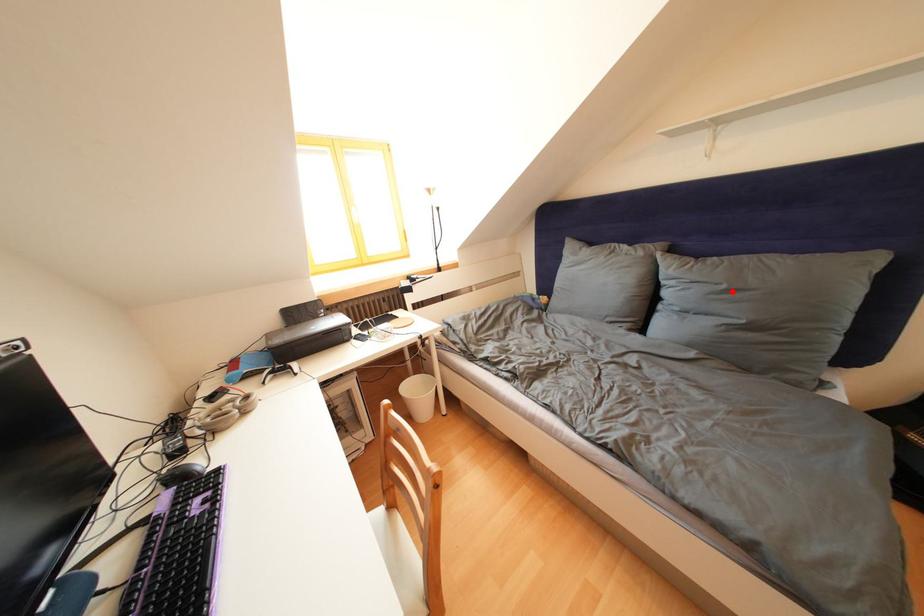
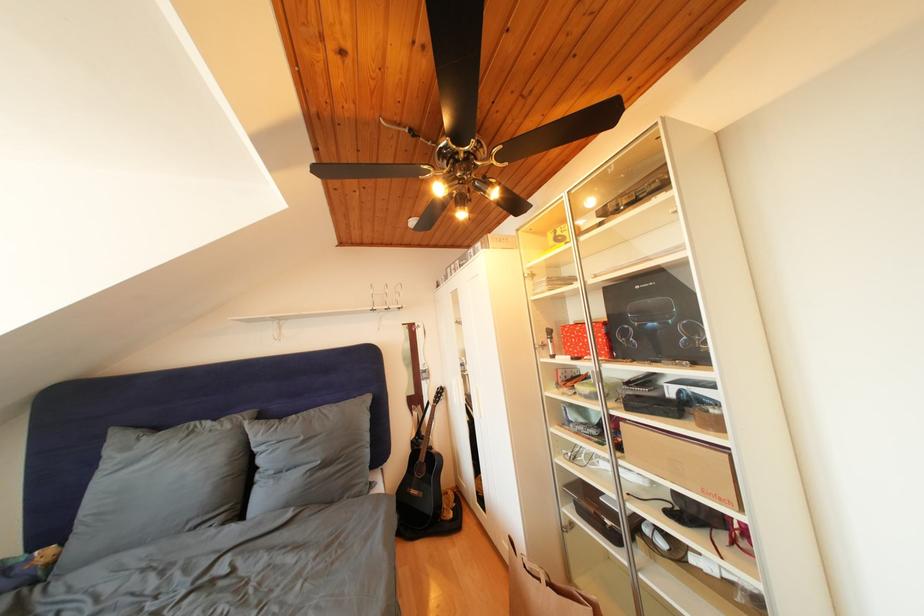
Question: I am providing you with two images of the same scene from different viewpoints. Image1 has a red point marked. In image2, the corresponding 3D location appears at what relative position? Reply with the corresponding letter.

Choices:
 (A) Closer
 (B) Farther

Answer: (B)